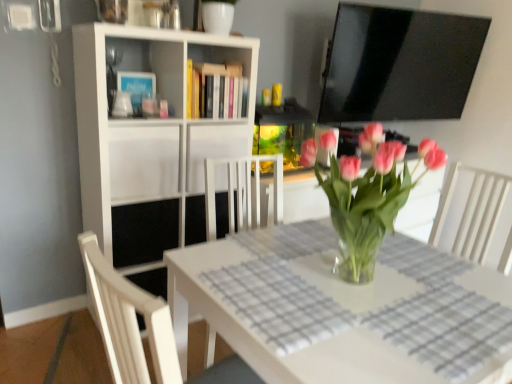
Find the location of a particular element. Image resolution: width=512 pixels, height=384 pixels. vacant area on top of clear glass table at center (from a real-world perspective) is located at coordinates (x=362, y=279).